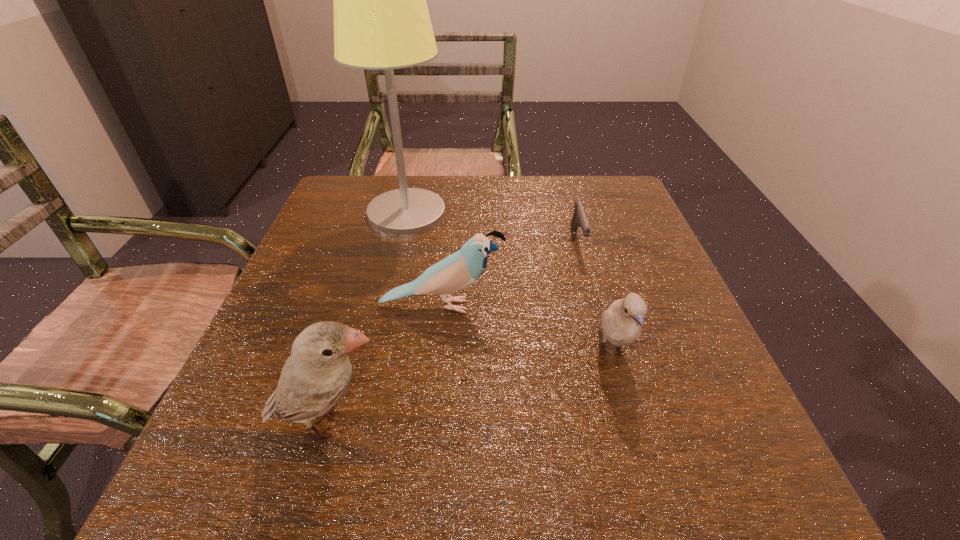
Locate an element on the screen. This screenshot has width=960, height=540. vacant space that's between the shortest object and the tallest bird is located at coordinates (453, 333).

You are a GUI agent. You are given a task and a screenshot of the screen. Output one action in this format:
    pyautogui.click(x=<x>, y=<y>)
    Task: Click on the vacant space that is in between the nearest bird and the farthest bird
    The height and width of the screenshot is (540, 960).
    Given the screenshot: What is the action you would take?
    pyautogui.click(x=385, y=365)

Find the location of a particular element. This screenshot has height=540, width=960. unoccupied area between the pistol and the third farthest object is located at coordinates (509, 274).

This screenshot has height=540, width=960. In order to click on vacant point located between the tallest bird and the tallest object in this screenshot , I will do `click(368, 319)`.

Image resolution: width=960 pixels, height=540 pixels. Identify the location of vacant space that's between the shortest object and the third nearest object. (509, 274).

Image resolution: width=960 pixels, height=540 pixels. In order to click on free spot between the rightmost bird and the farthest bird in this screenshot , I will do `click(526, 329)`.

At what (x,y) coordinates should I click in order to perform the action: click on object that is the fourth nearest to the farthest bird. Please return your answer as a coordinate pair (x, y). Looking at the image, I should click on (579, 218).

Locate which object ranks fourth in proximity to the third farthest object. Please provide its 2D coordinates. Your answer should be formatted as a tuple, i.e. [(x, y)], where the tuple contains the x and y coordinates of a point satisfying the conditions above.

[(579, 218)]

Select which bird is the closest to the fourth farthest object. Please provide its 2D coordinates. Your answer should be formatted as a tuple, i.e. [(x, y)], where the tuple contains the x and y coordinates of a point satisfying the conditions above.

[(457, 271)]

You are a GUI agent. You are given a task and a screenshot of the screen. Output one action in this format:
    pyautogui.click(x=<x>, y=<y>)
    Task: Click on the second closest bird to the second nearest object
    The image size is (960, 540).
    Given the screenshot: What is the action you would take?
    pyautogui.click(x=318, y=372)